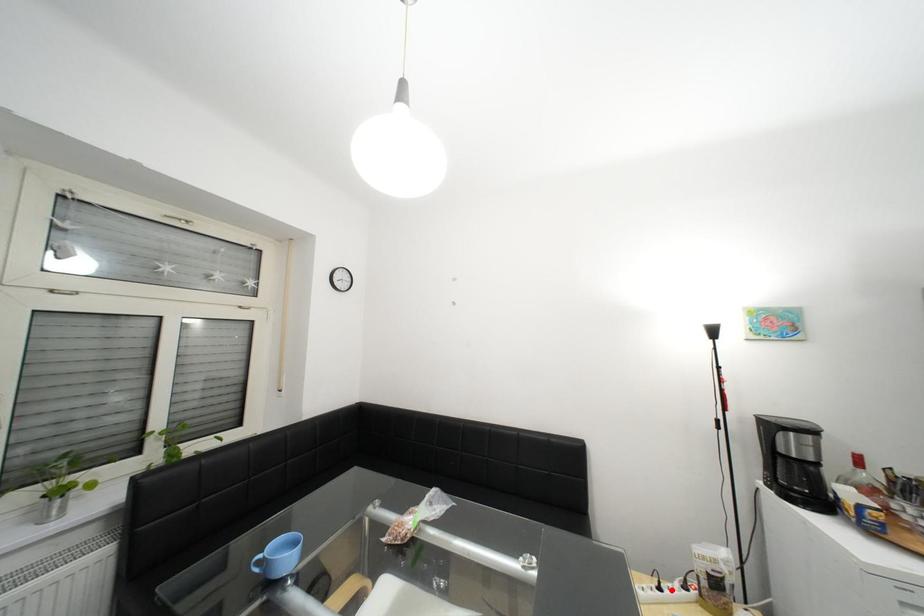
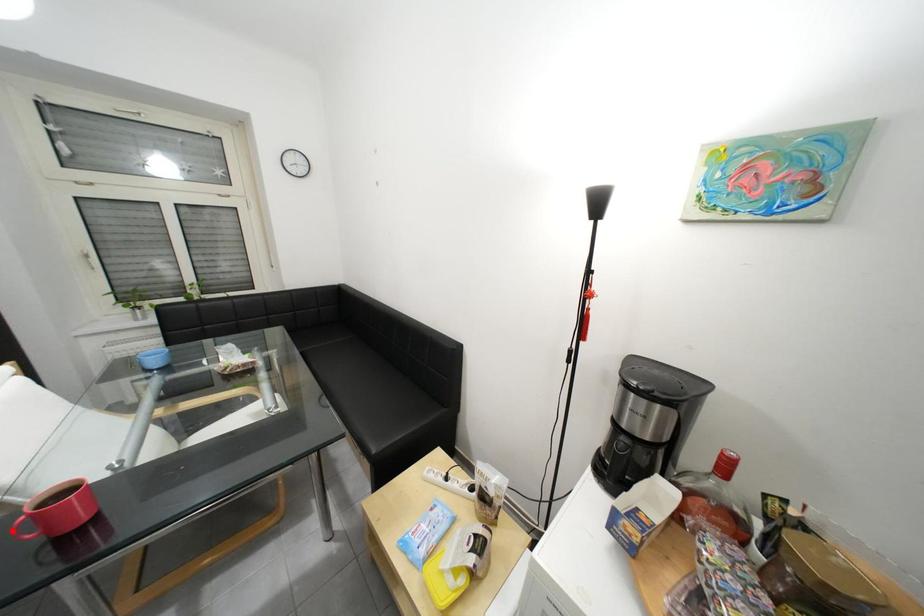
I am providing you with two images of the same scene from different viewpoints. A red point is marked on the first image and another point is marked on the second image. Does the point marked in image1 correspond to the same location as the one in image2?

No